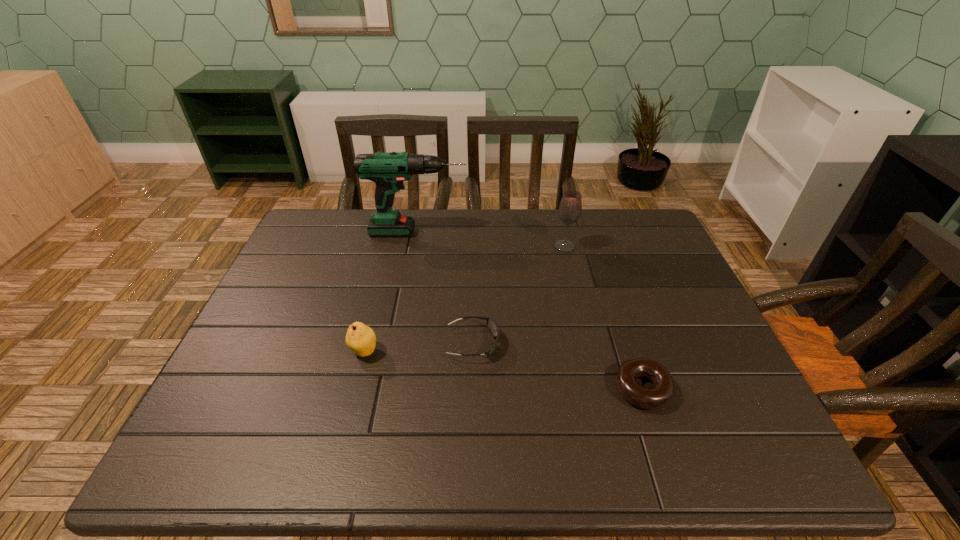
Locate an element on the screen. This screenshot has width=960, height=540. unoccupied area between the goggles and the third shortest object is located at coordinates (419, 347).

You are a GUI agent. You are given a task and a screenshot of the screen. Output one action in this format:
    pyautogui.click(x=<x>, y=<y>)
    Task: Click on the vacant area that lies between the second object from right to left and the third tallest object
    
    Given the screenshot: What is the action you would take?
    pyautogui.click(x=465, y=299)

This screenshot has height=540, width=960. I want to click on free space between the tallest object and the second farthest object, so click(492, 239).

I want to click on object that can be found as the third closest to the goggles, so click(570, 208).

At what (x,y) coordinates should I click in order to perform the action: click on the third closest object to the nearest object. Please return your answer as a coordinate pair (x, y). Image resolution: width=960 pixels, height=540 pixels. Looking at the image, I should click on (361, 339).

Find the location of a particular element. Image resolution: width=960 pixels, height=540 pixels. vacant space that satisfies the following two spatial constraints: 1. on the back side of the doughnut; 2. on the lenses of the goggles is located at coordinates (628, 343).

The width and height of the screenshot is (960, 540). I want to click on free location that satisfies the following two spatial constraints: 1. on the front side of the third shortest object; 2. on the right side of the nearest object, so click(x=354, y=389).

Locate an element on the screen. free space that satisfies the following two spatial constraints: 1. on the handle side of the glass drink container; 2. on the right side of the tallest object is located at coordinates (416, 247).

Locate an element on the screen. The height and width of the screenshot is (540, 960). vacant space that satisfies the following two spatial constraints: 1. on the lenses of the goggles; 2. on the back side of the doughnut is located at coordinates (471, 389).

Find the location of a particular element. The height and width of the screenshot is (540, 960). free space that satisfies the following two spatial constraints: 1. on the handle side of the farthest object; 2. on the front side of the third shortest object is located at coordinates (396, 351).